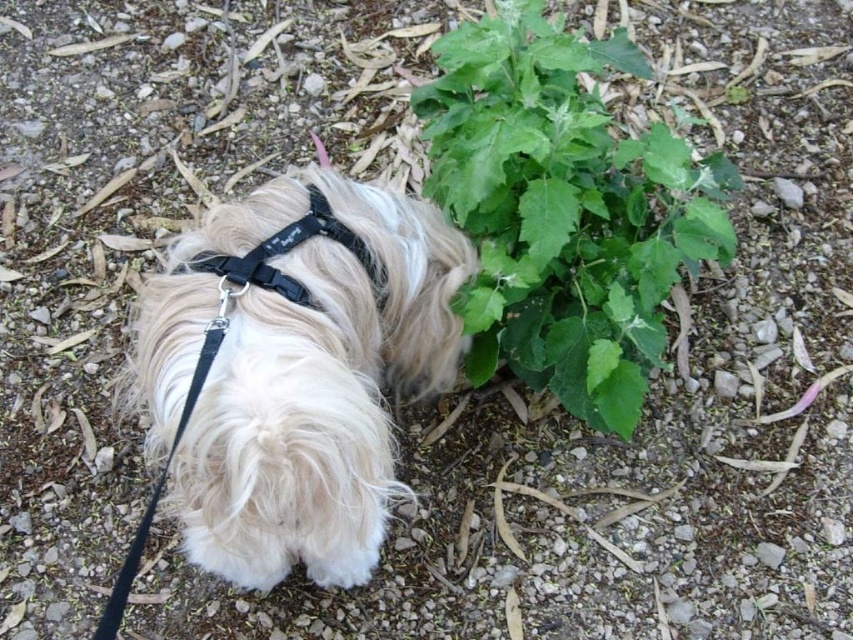
From the picture: Between white fluffy dog at center and green leafy plant at center, which one has less height?

white fluffy dog at center

Does point (236, 440) come closer to viewer compared to point (448, 49)?

Yes, point (236, 440) is in front of point (448, 49).

Find the location of a particular element. The width and height of the screenshot is (853, 640). white fluffy dog at center is located at coordinates (296, 369).